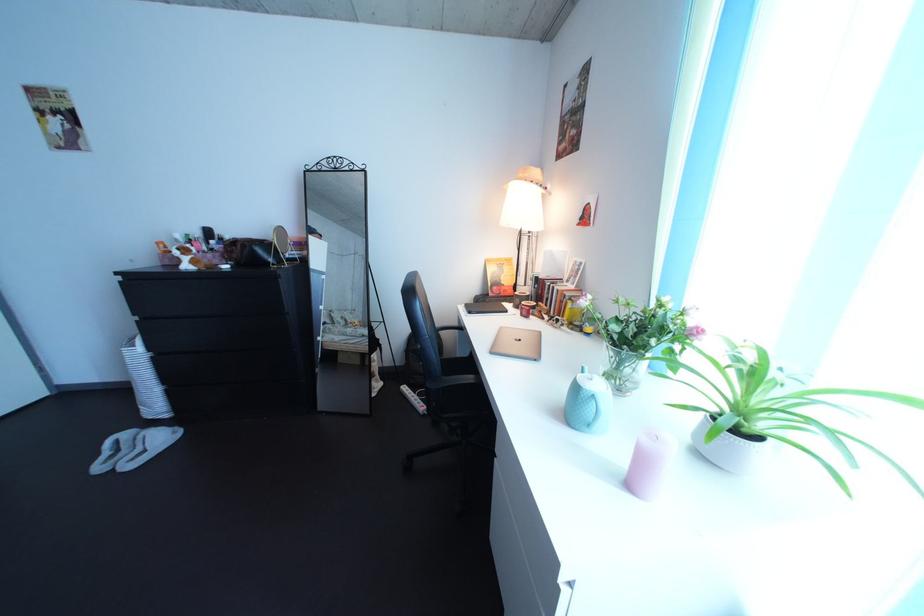
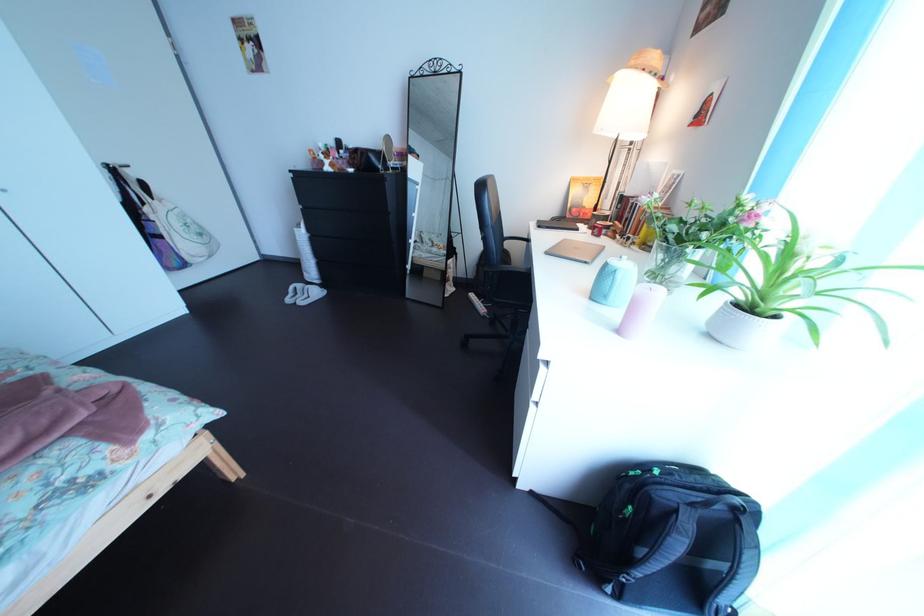
The point at (x=476, y=336) is marked in the first image. Where is the corresponding point in the second image?

(541, 248)